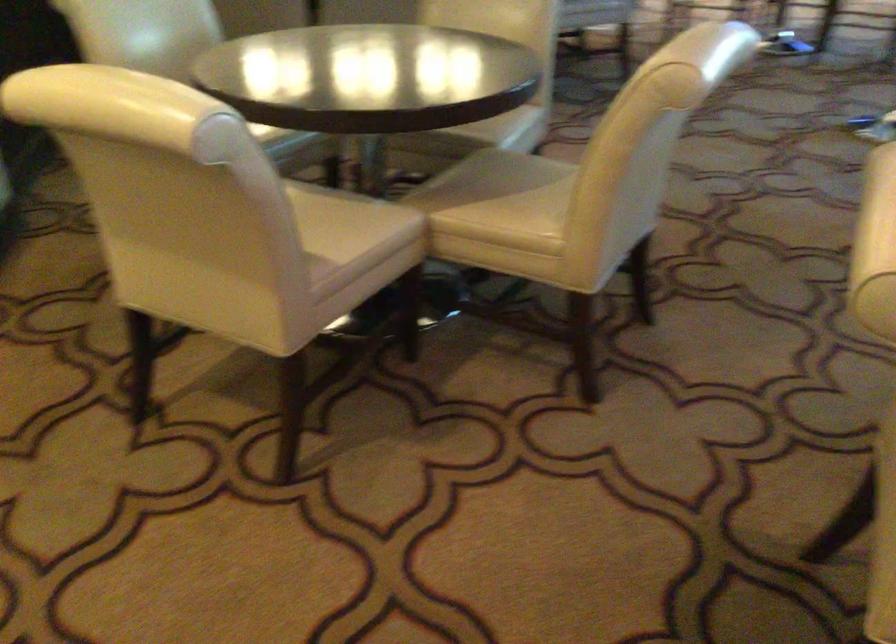
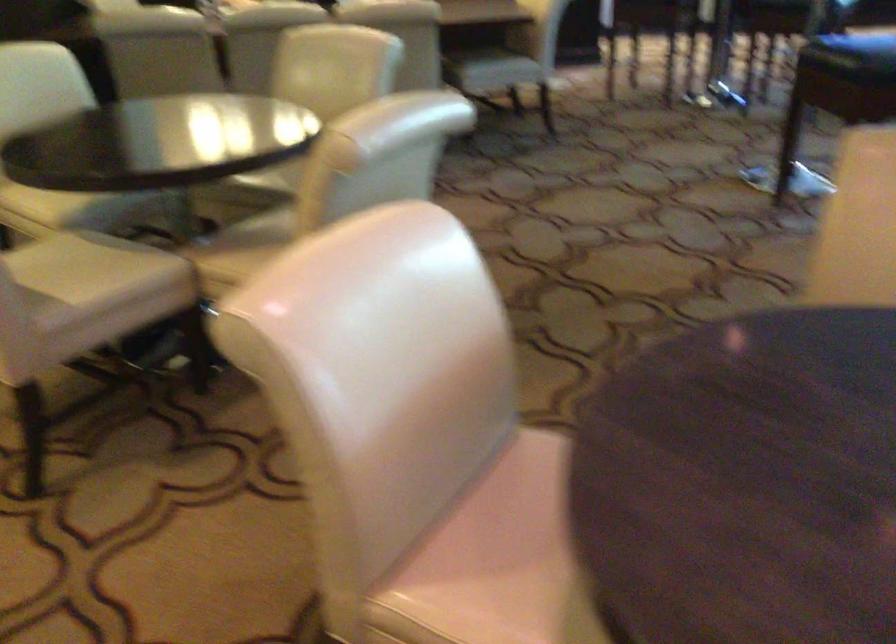
Question: The camera is either moving clockwise (left) or counter-clockwise (right) around the object. The first image is from the beginning of the video and the second image is from the end. Is the camera moving left or right when shooting the video?

Choices:
 (A) Left
 (B) Right

Answer: (B)